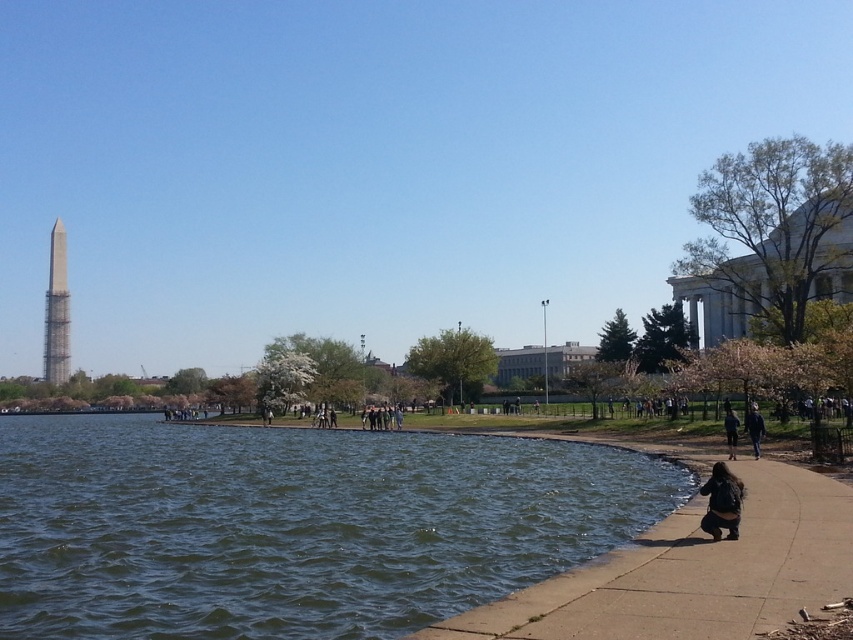
Find the location of `greenish-blue water at lower left`. greenish-blue water at lower left is located at coordinates (293, 525).

Is greenish-blue water at lower left wider than dark blue jacket at lower right?

Correct, the width of greenish-blue water at lower left exceeds that of dark blue jacket at lower right.

Where is `greenish-blue water at lower left`? This screenshot has width=853, height=640. greenish-blue water at lower left is located at coordinates (293, 525).

The width and height of the screenshot is (853, 640). Identify the location of greenish-blue water at lower left. (293, 525).

Is concrete sidewalk at lower right bigger than dark blue jeans at lower right?

Yes.

Between point (842, 522) and point (727, 416), which one is positioned behind?

The point (727, 416) is behind.

Who is more forward, [813,540] or [724,433]?

Point [813,540] is more forward.

I want to click on concrete sidewalk at lower right, so pyautogui.click(x=692, y=572).

Can you confirm if silver metallic tower at left is positioned above dark blue jeans at lower right?

Indeed, silver metallic tower at left is positioned over dark blue jeans at lower right.

Can you confirm if silver metallic tower at left is positioned below dark blue jeans at lower right?

Actually, silver metallic tower at left is above dark blue jeans at lower right.

The width and height of the screenshot is (853, 640). I want to click on silver metallic tower at left, so click(x=56, y=310).

Identify the location of silver metallic tower at left. (56, 310).